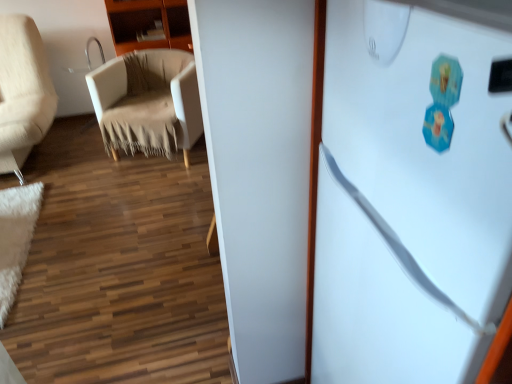
Image resolution: width=512 pixels, height=384 pixels. I want to click on wooden cabinet at upper left, so click(x=148, y=24).

Image resolution: width=512 pixels, height=384 pixels. In order to click on white fluffy mat at lower left in this screenshot , I will do `click(16, 238)`.

Considering the relative sizes of white matte refrigerator at right and wooden cabinet at upper left in the image provided, is white matte refrigerator at right shorter than wooden cabinet at upper left?

No, white matte refrigerator at right is not shorter than wooden cabinet at upper left.

Are white matte refrigerator at right and wooden cabinet at upper left located far from each other?

white matte refrigerator at right is positioned a significant distance from wooden cabinet at upper left.

From a real-world perspective, is white matte refrigerator at right under wooden cabinet at upper left?

Yes.

Is white matte refrigerator at right positioned beyond the bounds of wooden cabinet at upper left?

That's correct, white matte refrigerator at right is outside of wooden cabinet at upper left.

Does white fluffy mat at lower left have a lesser width compared to beige fabric chair at left?

Yes.

Considering the relative sizes of white fluffy mat at lower left and beige fabric chair at left in the image provided, is white fluffy mat at lower left smaller than beige fabric chair at left?

Yes, white fluffy mat at lower left is smaller than beige fabric chair at left.

In terms of height, does white fluffy mat at lower left look taller or shorter compared to beige fabric chair at left?

In the image, white fluffy mat at lower left appears to be shorter than beige fabric chair at left.

Is the surface of white fluffy mat at lower left in direct contact with beige fabric chair at left?

No, white fluffy mat at lower left is not with beige fabric chair at left.

Is wooden cabinet at upper left positioned beyond the bounds of white fluffy mat at lower left?

Yes.

Which object is wider, wooden cabinet at upper left or white fluffy mat at lower left?

Wider between the two is wooden cabinet at upper left.

Which is in front, wooden cabinet at upper left or white fluffy mat at lower left?

white fluffy mat at lower left is closer to the camera.

From the image's perspective, between wooden cabinet at upper left and white fluffy mat at lower left, which one is located above?

From the image's view, wooden cabinet at upper left is above.

Considering the sizes of wooden cabinet at upper left and beige fabric chair at left in the image, is wooden cabinet at upper left bigger or smaller than beige fabric chair at left?

Considering their sizes, wooden cabinet at upper left takes up less space than beige fabric chair at left.

Is wooden cabinet at upper left turned away from beige fabric chair at left?

That's not correct — wooden cabinet at upper left is not looking away from beige fabric chair at left.

How different are the orientations of wooden cabinet at upper left and beige fabric chair at left in degrees?

27.7 degrees separate the facing orientations of wooden cabinet at upper left and beige fabric chair at left.

Which object is further away from the camera taking this photo, wooden cabinet at upper left or beige fabric chair at left?

wooden cabinet at upper left is behind.

In the scene shown: Which object is further away from the camera taking this photo, wooden cabinet at upper left or white matte refrigerator at right?

wooden cabinet at upper left is behind.

How far apart are wooden cabinet at upper left and white matte refrigerator at right?

wooden cabinet at upper left and white matte refrigerator at right are 8.96 feet apart.

Is white matte refrigerator at right at the back of wooden cabinet at upper left?

No.

Between wooden cabinet at upper left and white matte refrigerator at right, which one has larger width?

white matte refrigerator at right is wider.

Considering the relative positions of beige fabric chair at left and white fluffy mat at lower left in the image provided, is beige fabric chair at left to the left of white fluffy mat at lower left from the viewer's perspective?

Incorrect, beige fabric chair at left is not on the left side of white fluffy mat at lower left.

From a real-world perspective, is beige fabric chair at left positioned over white fluffy mat at lower left based on gravity?

Yes.

From the image's perspective, is beige fabric chair at left beneath white fluffy mat at lower left?

Incorrect, from the image's perspective, beige fabric chair at left is higher than white fluffy mat at lower left.

Where is `chair that is behind the white fluffy mat at lower left`? The width and height of the screenshot is (512, 384). chair that is behind the white fluffy mat at lower left is located at coordinates (147, 102).

Considering the positions of objects beige fabric chair at left and white matte refrigerator at right in the image provided, who is more to the left, beige fabric chair at left or white matte refrigerator at right?

beige fabric chair at left.

From a real-world perspective, is beige fabric chair at left positioned above or below white matte refrigerator at right?

beige fabric chair at left is below white matte refrigerator at right.

This screenshot has width=512, height=384. Identify the location of chair above the white matte refrigerator at right (from the image's perspective). (147, 102).

Is beige fabric chair at left taller or shorter than white matte refrigerator at right?

In the image, beige fabric chair at left appears to be shorter than white matte refrigerator at right.

The image size is (512, 384). Identify the location of refrigerator in front of the wooden cabinet at upper left. (413, 191).

Where is `chair above the white fluffy mat at lower left (from a real-world perspective)`? Image resolution: width=512 pixels, height=384 pixels. chair above the white fluffy mat at lower left (from a real-world perspective) is located at coordinates (147, 102).

Considering their positions, is beige fabric chair at left positioned closer to wooden cabinet at upper left than white matte refrigerator at right?

Among the two, beige fabric chair at left is located nearer to wooden cabinet at upper left.

From the image, which object appears to be nearer to white matte refrigerator at right, beige fabric chair at left or wooden cabinet at upper left?

beige fabric chair at left is closer to white matte refrigerator at right.

Based on the photo, which object lies further to the anchor point wooden cabinet at upper left, beige fabric chair at left or white fluffy mat at lower left?

The object further to wooden cabinet at upper left is white fluffy mat at lower left.

Estimate the real-world distances between objects in this image. Which object is further from wooden cabinet at upper left, white fluffy mat at lower left or beige fabric chair at left?

white fluffy mat at lower left is positioned further to the anchor wooden cabinet at upper left.

Estimate the real-world distances between objects in this image. Which object is further from wooden cabinet at upper left, white matte refrigerator at right or beige fabric chair at left?

Among the two, white matte refrigerator at right is located further to wooden cabinet at upper left.

When comparing their distances from beige fabric chair at left, does white matte refrigerator at right or wooden cabinet at upper left seem closer?

Among the two, wooden cabinet at upper left is located nearer to beige fabric chair at left.

Estimate the real-world distances between objects in this image. Which object is further from white matte refrigerator at right, white fluffy mat at lower left or wooden cabinet at upper left?

wooden cabinet at upper left is further to white matte refrigerator at right.

Looking at the image, which one is located closer to white fluffy mat at lower left, beige fabric chair at left or wooden cabinet at upper left?

Among the two, beige fabric chair at left is located nearer to white fluffy mat at lower left.

You are a GUI agent. You are given a task and a screenshot of the screen. Output one action in this format:
    pyautogui.click(x=<x>, y=<y>)
    Task: Click on the mat between white matte refrigerator at right and beige fabric chair at left from front to back
    The width and height of the screenshot is (512, 384).
    Given the screenshot: What is the action you would take?
    pyautogui.click(x=16, y=238)

This screenshot has width=512, height=384. In order to click on chair located between white matte refrigerator at right and wooden cabinet at upper left in the depth direction in this screenshot , I will do `click(147, 102)`.

Find the location of a particular element. The image size is (512, 384). chair between wooden cabinet at upper left and white fluffy mat at lower left in the up-down direction is located at coordinates (147, 102).

Identify the location of mat between white matte refrigerator at right and wooden cabinet at upper left in the front-back direction. (16, 238).